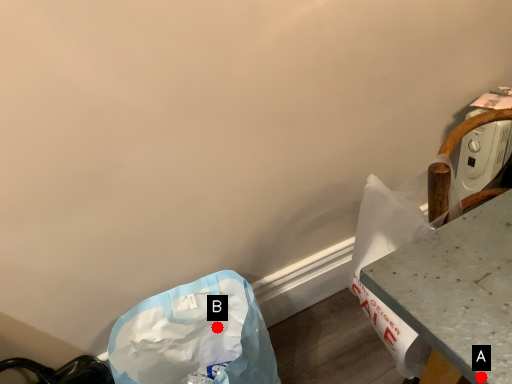
Question: Two points are circled on the image, labeled by A and B beside each circle. Which point is closer to the camera?

Choices:
 (A) A is closer
 (B) B is closer

Answer: (A)